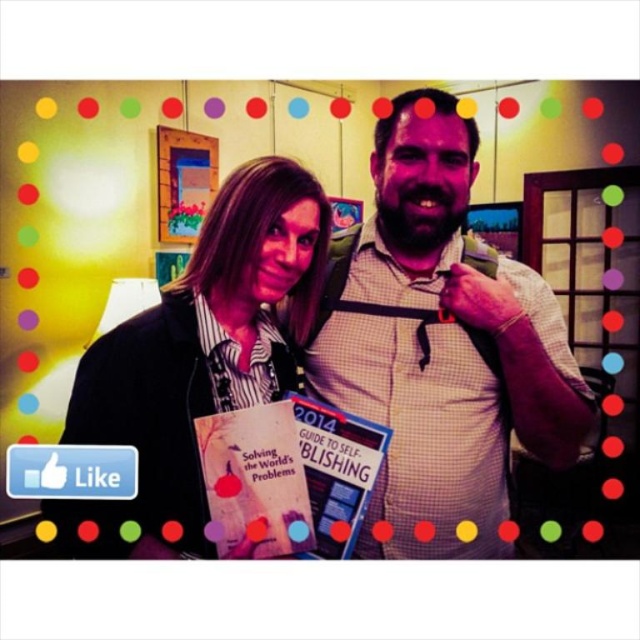
You are a photographer at a book signing event. You need to adjust the lighting so that the white checkered shirt at center and the matte black shirt at center are both visible. Which shirt should you focus the light on more to ensure both are properly lit?

The white checkered shirt at center is taller than matte black shirt at center. Since the white checkered shirt is taller, you should focus more light on the matte black shirt at center to balance the exposure, as darker colors absorb more light and require additional illumination to appear properly lit compared to lighter, reflective fabrics.

You are a photographer at an event and notice two shirts in the center of the image. The white checkered shirt at center and the matte black shirt at center. Which one is positioned higher?

The white checkered shirt at center is above the matte black shirt at center, so the white checkered shirt at center is positioned higher.

You are a photographer at an event and want to capture a closeup of the white checkered shirt at center and the matte black shirt at center. Which shirt should you focus on first to ensure it appears sharp in the photo?

You should focus on the white checkered shirt at center first because it is closer to the viewer than the matte black shirt at center, so it requires proper focus to appear sharp.